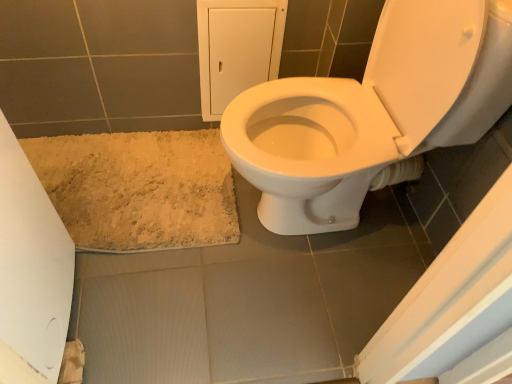
Question: Considering the positions of beige shaggy bath mat at lower left and white glossy toilet at center in the image, is beige shaggy bath mat at lower left taller or shorter than white glossy toilet at center?

Choices:
 (A) tall
 (B) short

Answer: (B)

Question: Visually, is beige shaggy bath mat at lower left positioned to the left or to the right of white glossy toilet at center?

Choices:
 (A) right
 (B) left

Answer: (B)

Question: Which object is the farthest from the white paper at lower left?

Choices:
 (A) white glossy toilet at center
 (B) beige shaggy bath mat at lower left

Answer: (A)

Question: Estimate the real-world distances between objects in this image. Which object is closer to the white glossy toilet at center?

Choices:
 (A) white paper at lower left
 (B) beige shaggy bath mat at lower left

Answer: (B)